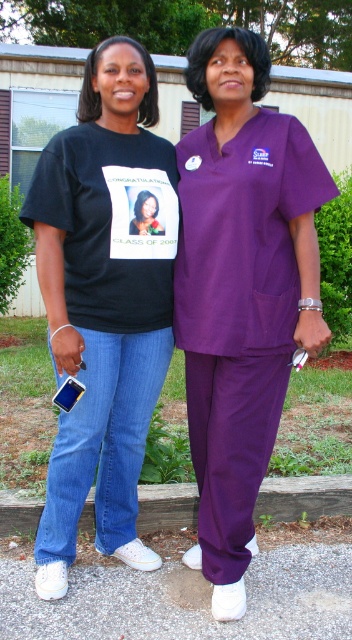
Question: Does matte purple scrubs at center have a lesser width compared to wooden at lower center?

Choices:
 (A) yes
 (B) no

Answer: (B)

Question: In this image, where is wooden at lower center located relative to matte black t-shirt at center?

Choices:
 (A) right
 (B) left

Answer: (A)

Question: Among these points, which one is farthest from the camera?

Choices:
 (A) (159, 392)
 (B) (195, 488)

Answer: (B)

Question: Which point appears closest to the camera in this image?

Choices:
 (A) (53, 216)
 (B) (230, 202)
 (C) (129, 221)

Answer: (A)

Question: Which point appears closest to the camera in this image?

Choices:
 (A) (146, 218)
 (B) (102, 376)
 (C) (116, 540)

Answer: (A)

Question: Does purple scrubs at center have a greater width compared to matte purple scrubs at center?

Choices:
 (A) no
 (B) yes

Answer: (B)